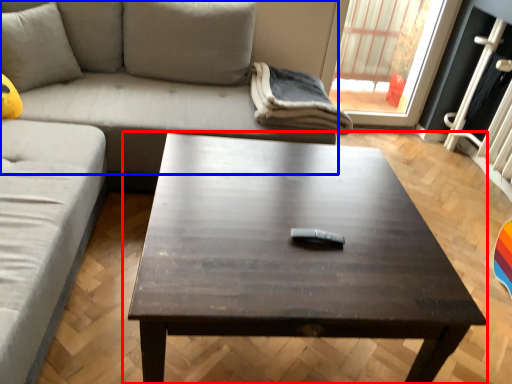
Question: Which point is closer to the camera, coffee table (highlighted by a red box) or studio couch (highlighted by a blue box)?

Choices:
 (A) coffee table
 (B) studio couch

Answer: (A)